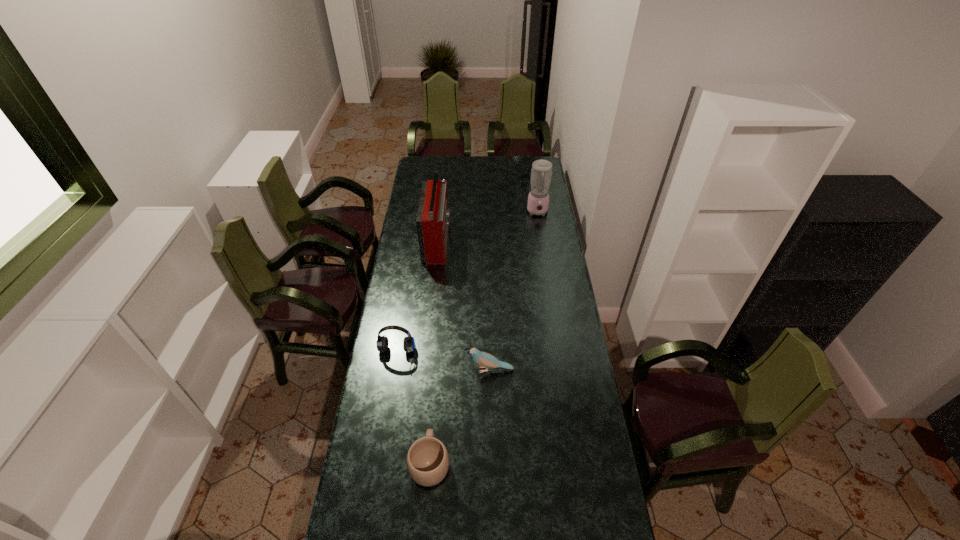
Identify the location of vacant space at the right edge of the desktop. Image resolution: width=960 pixels, height=540 pixels. (526, 208).

Find the location of a particular element. The image size is (960, 540). vacant area at the far left corner is located at coordinates (416, 158).

Where is `unoccupied position between the food processor and the radio receiver`? This screenshot has height=540, width=960. unoccupied position between the food processor and the radio receiver is located at coordinates (488, 226).

The width and height of the screenshot is (960, 540). I want to click on vacant space that is in between the rightmost object and the headset, so click(467, 285).

The width and height of the screenshot is (960, 540). I want to click on blank region between the rightmost object and the bird, so click(514, 291).

In order to click on empty space between the radio receiver and the headset in this screenshot , I will do `click(417, 299)`.

Identify the location of vacant area that lies between the headset and the radio receiver. (417, 299).

At what (x,y) coordinates should I click in order to perform the action: click on empty space that is in between the fourth object from left to right and the headset. Please return your answer as a coordinate pair (x, y). This screenshot has width=960, height=540. Looking at the image, I should click on (443, 364).

Where is `free space between the radio receiver and the headset`? free space between the radio receiver and the headset is located at coordinates (417, 299).

Image resolution: width=960 pixels, height=540 pixels. In order to click on vacant region between the rightmost object and the second object from right to left in this screenshot , I will do `click(514, 291)`.